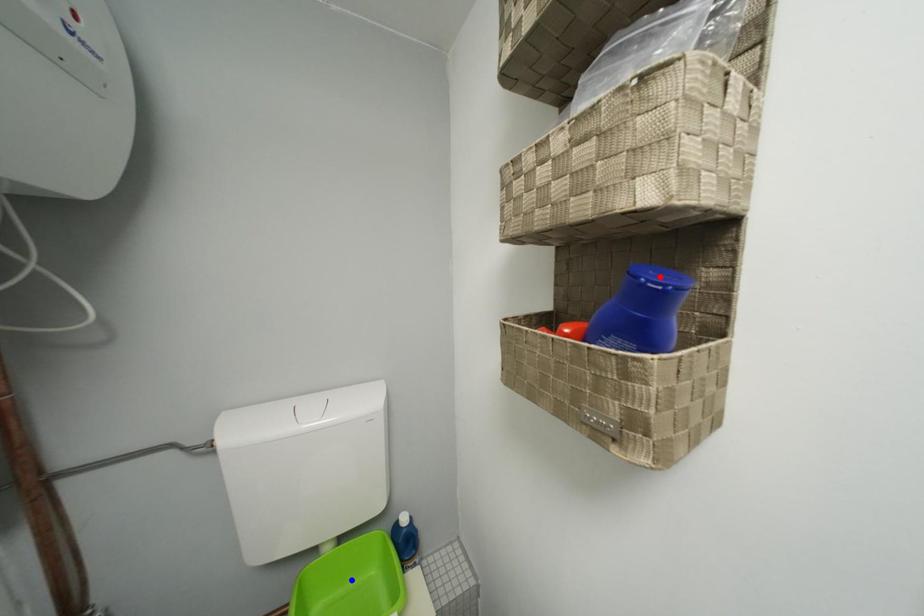
Question: In the image, two points are highlighted. Which point is nearer to the camera? Reply with the corresponding letter.

Choices:
 (A) blue point
 (B) red point

Answer: (B)